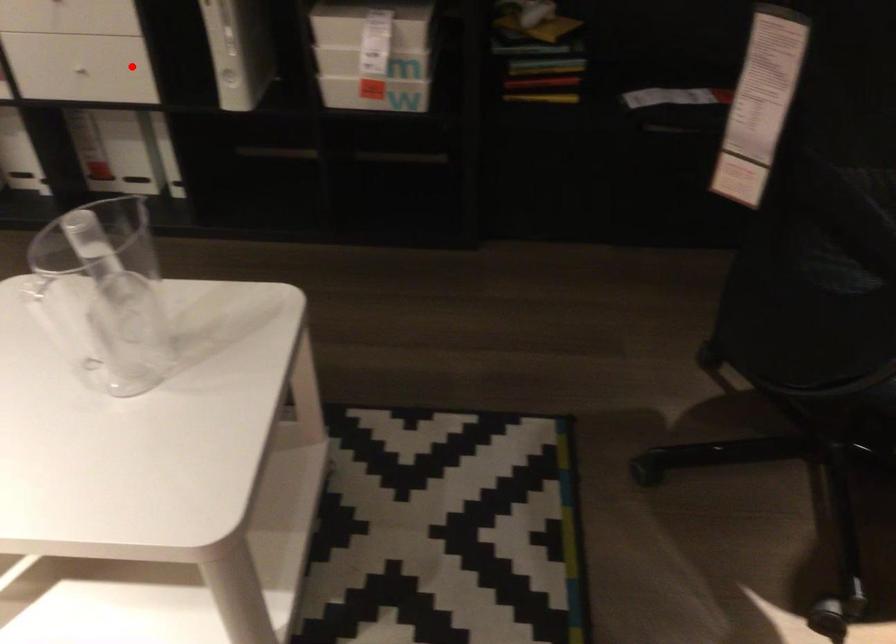
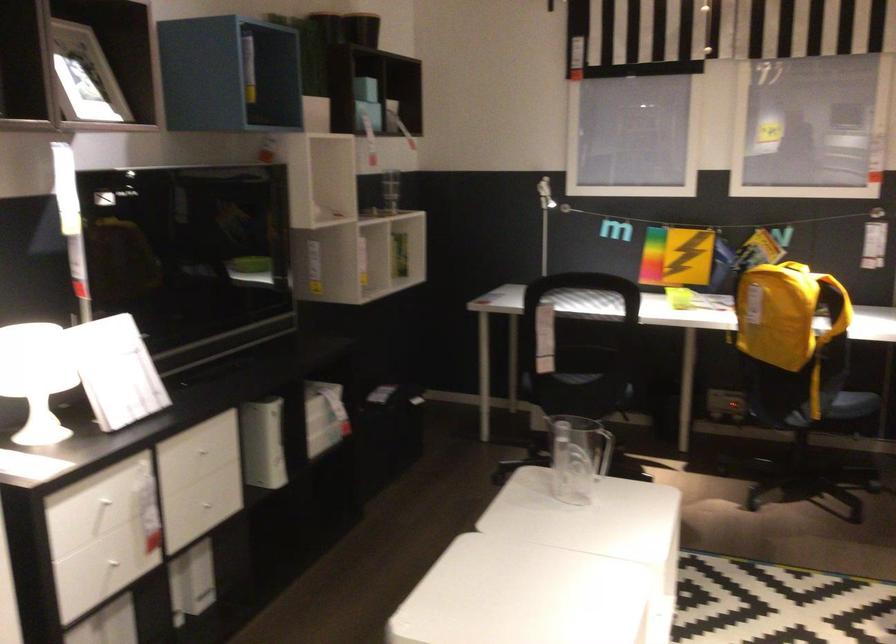
Find the pixel in the second image that matches the highlighted location in the first image.

(209, 504)